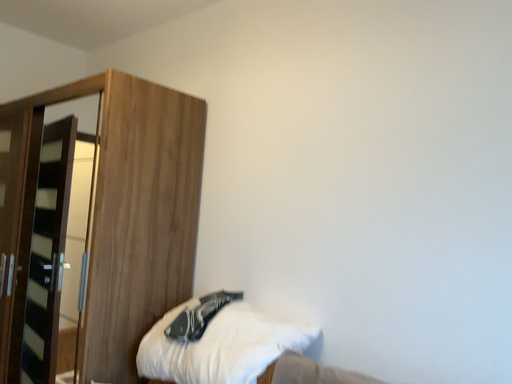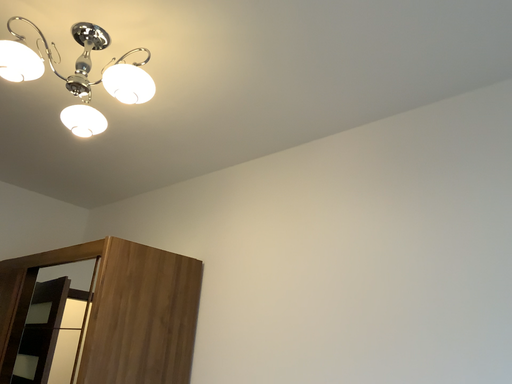
Question: Which way did the camera rotate in the video?

Choices:
 (A) rotated downward
 (B) rotated upward

Answer: (B)